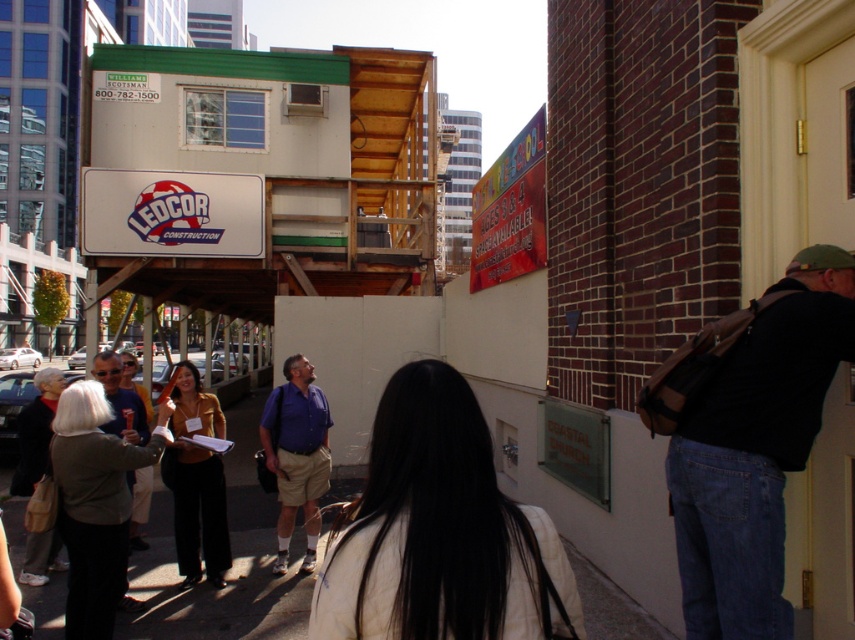
Which is above, white matte jacket at center or blue cotton shirt at center?

white matte jacket at center

What do you see at coordinates (440, 532) in the screenshot?
I see `white matte jacket at center` at bounding box center [440, 532].

Locate an element on the screen. The width and height of the screenshot is (855, 640). white matte jacket at center is located at coordinates (440, 532).

Is white matte jacket at center shorter than smooth concrete pavement at lower center?

Incorrect, white matte jacket at center's height does not fall short of smooth concrete pavement at lower center's.

Between white matte jacket at center and smooth concrete pavement at lower center, which one appears on the left side from the viewer's perspective?

From the viewer's perspective, smooth concrete pavement at lower center appears more on the left side.

Does point (458, 381) come in front of point (171, 516)?

Yes, point (458, 381) is closer to viewer.

Locate an element on the screen. white matte jacket at center is located at coordinates (440, 532).

Identify the location of white matte jacket at center. This screenshot has height=640, width=855. (440, 532).

Locate an element on the screen. white matte jacket at center is located at coordinates (440, 532).